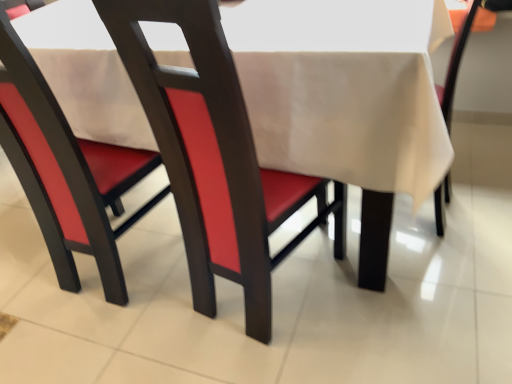
Where is `vacant space to the right of matte wood chair at center, arranged as the second chair when viewed from the left`? vacant space to the right of matte wood chair at center, arranged as the second chair when viewed from the left is located at coordinates (380, 292).